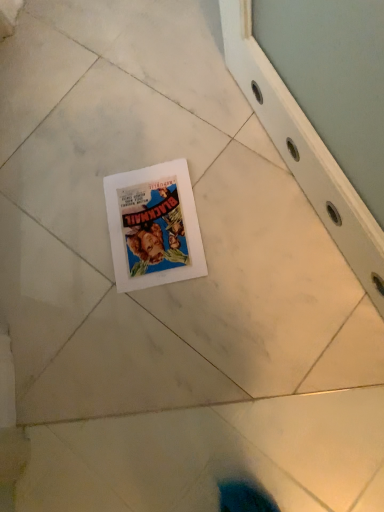
At what (x,y) coordinates should I click in order to perform the action: click on vacant point to the right of matte paper comic book at center. Please return your answer as a coordinate pair (x, y). The image size is (384, 512). Looking at the image, I should click on (235, 179).